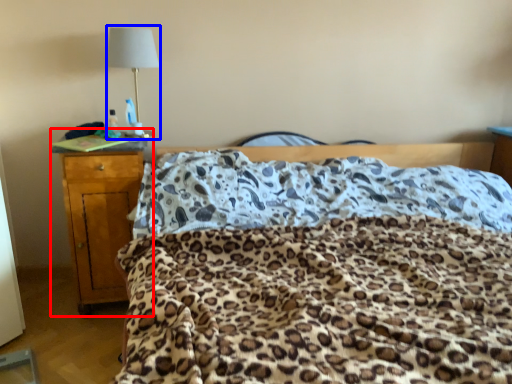
Question: Which object is closer to the camera taking this photo, nightstand (highlighted by a red box) or lamp (highlighted by a blue box)?

Choices:
 (A) nightstand
 (B) lamp

Answer: (A)